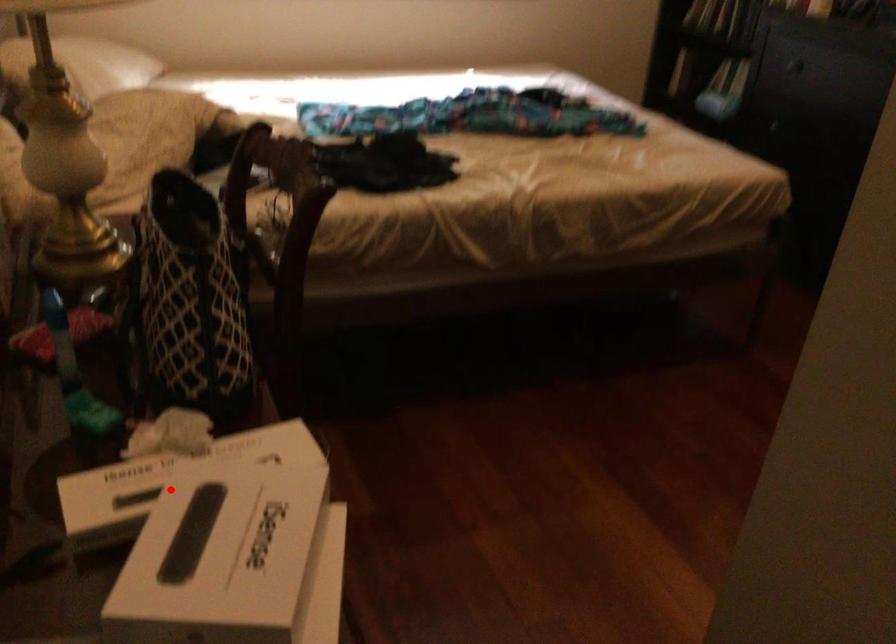
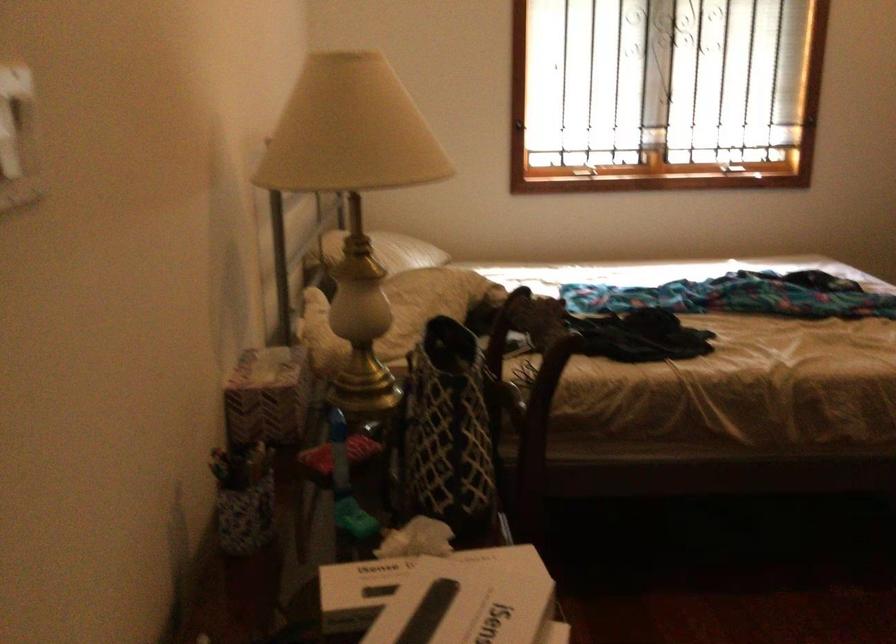
Where in the second image is the point corresponding to the highlighted location from the first image?

(407, 583)